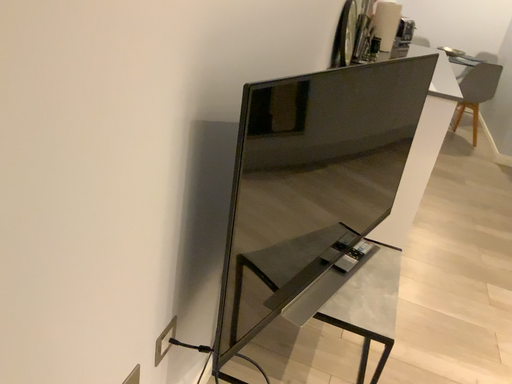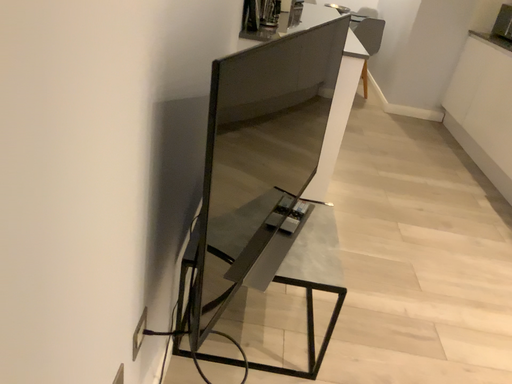
Question: How did the camera likely rotate when shooting the video?

Choices:
 (A) rotated right
 (B) rotated left

Answer: (A)